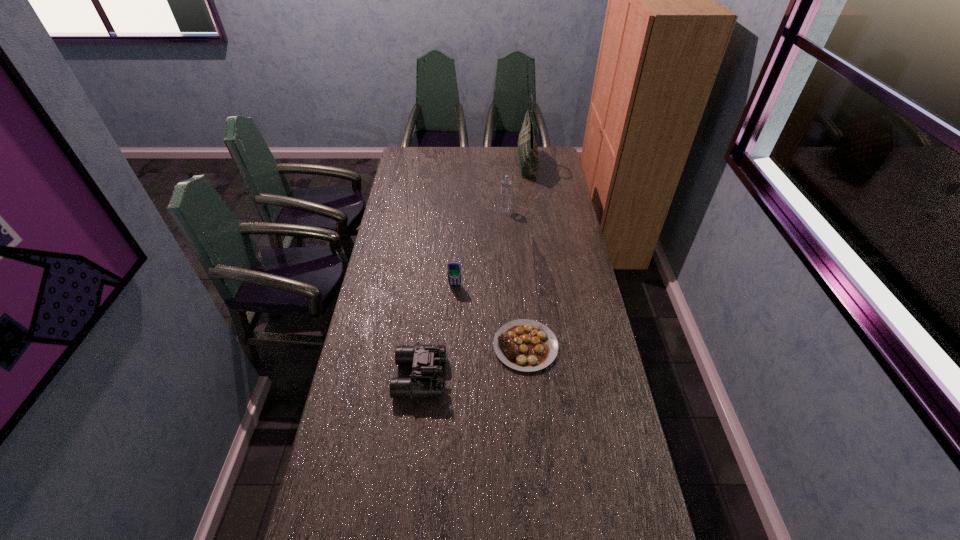
Locate an element on the screen. The width and height of the screenshot is (960, 540). the tallest object is located at coordinates (527, 148).

What are the coordinates of `tote bag` in the screenshot? It's located at (527, 148).

Locate an element on the screen. This screenshot has height=540, width=960. water bottle is located at coordinates (506, 184).

Where is `the fourth nearest object`? the fourth nearest object is located at coordinates (506, 184).

Find the location of a particular element. cellular telephone is located at coordinates (x=454, y=268).

The height and width of the screenshot is (540, 960). Find the location of `binoculars`. binoculars is located at coordinates (426, 359).

At what (x,y) coordinates should I click in order to perform the action: click on steak. Please return your answer as a coordinate pair (x, y). The image size is (960, 540). Looking at the image, I should click on (526, 345).

What are the coordinates of `vacant position located 0.170m on the front of the tote bag` in the screenshot? It's located at (532, 201).

At what (x,y) coordinates should I click in order to perform the action: click on vacant space positioned on the left of the fourth shortest object. Please return your answer as a coordinate pair (x, y). This screenshot has width=960, height=540. Looking at the image, I should click on (470, 211).

Locate an element on the screen. The image size is (960, 540). free location located 0.400m on the front-facing side of the third nearest object is located at coordinates (450, 373).